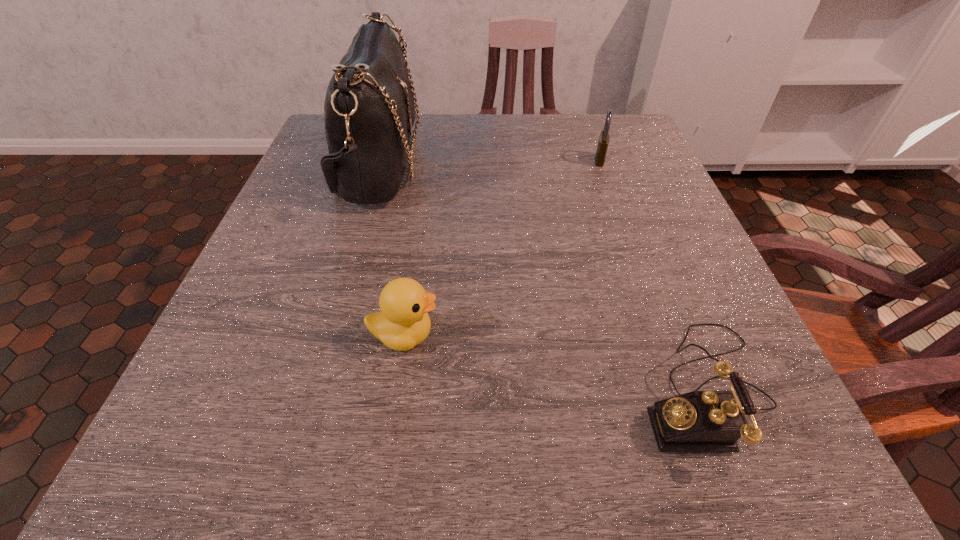
Locate an element on the screen. Image resolution: width=960 pixels, height=540 pixels. handbag is located at coordinates (369, 109).

Identify the location of padlock. (603, 142).

This screenshot has width=960, height=540. I want to click on duck, so click(x=403, y=322).

Where is `telephone`? telephone is located at coordinates (699, 421).

This screenshot has height=540, width=960. Find the location of `vacant space situated 0.310m at the front of the handbag with chain and zipper`. vacant space situated 0.310m at the front of the handbag with chain and zipper is located at coordinates (557, 164).

The image size is (960, 540). In order to click on free space located 0.330m on the left of the padlock in this screenshot , I will do `click(450, 160)`.

Where is `free spot located 0.200m on the face of the duck`? This screenshot has height=540, width=960. free spot located 0.200m on the face of the duck is located at coordinates (572, 335).

Locate an element on the screen. The height and width of the screenshot is (540, 960). blank space located 0.370m on the dial of the telephone is located at coordinates (369, 389).

Locate an element on the screen. The width and height of the screenshot is (960, 540). free space located on the dial of the telephone is located at coordinates (544, 389).

I want to click on vacant space located on the dial of the telephone, so click(391, 389).